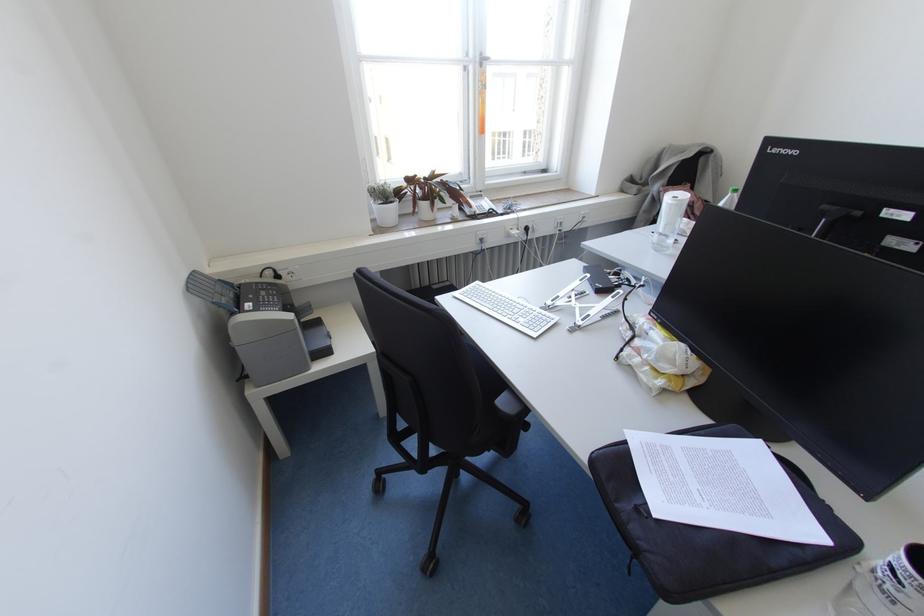
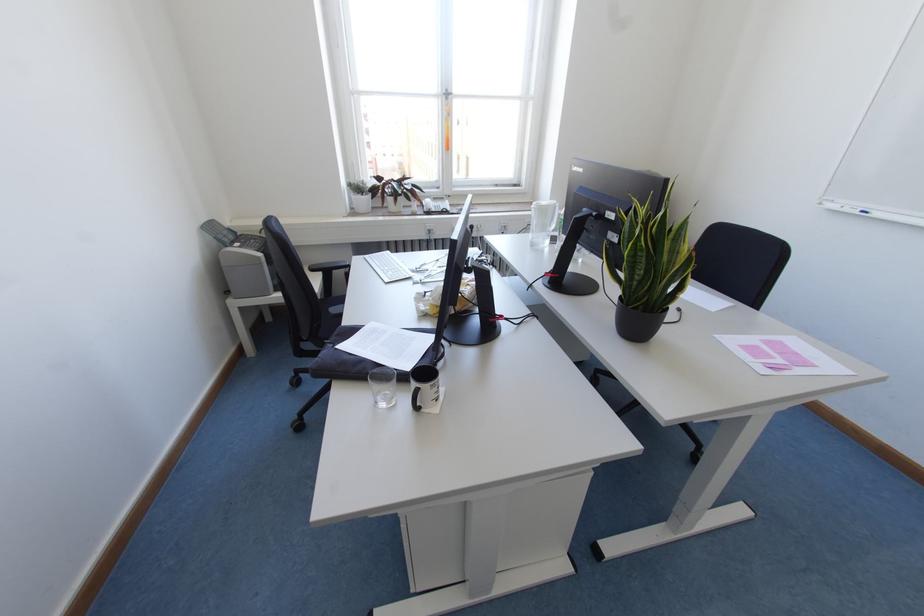
Find the pixel in the second image that matches point (480, 65) in the first image.

(446, 98)